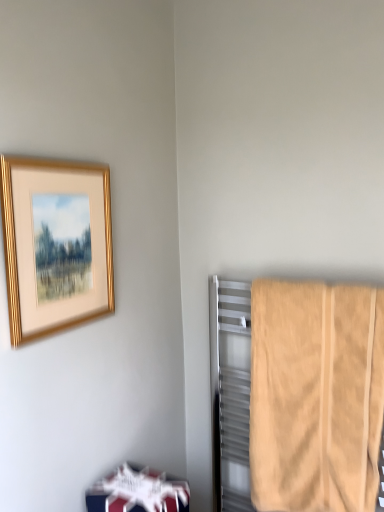
Question: Is point 365,485 positioned closer to the camera than point 155,482?

Choices:
 (A) farther
 (B) closer

Answer: (B)

Question: Considering the positions of beige cotton towel at right and white glossy bookshelf at lower left in the image, is beige cotton towel at right wider or thinner than white glossy bookshelf at lower left?

Choices:
 (A) wide
 (B) thin

Answer: (B)

Question: Which object is positioned closest to the gold metallic picture frame at upper left?

Choices:
 (A) white glossy bookshelf at lower left
 (B) beige cotton towel at right

Answer: (A)

Question: Which is nearer to the white glossy bookshelf at lower left?

Choices:
 (A) gold metallic picture frame at upper left
 (B) beige cotton towel at right

Answer: (B)